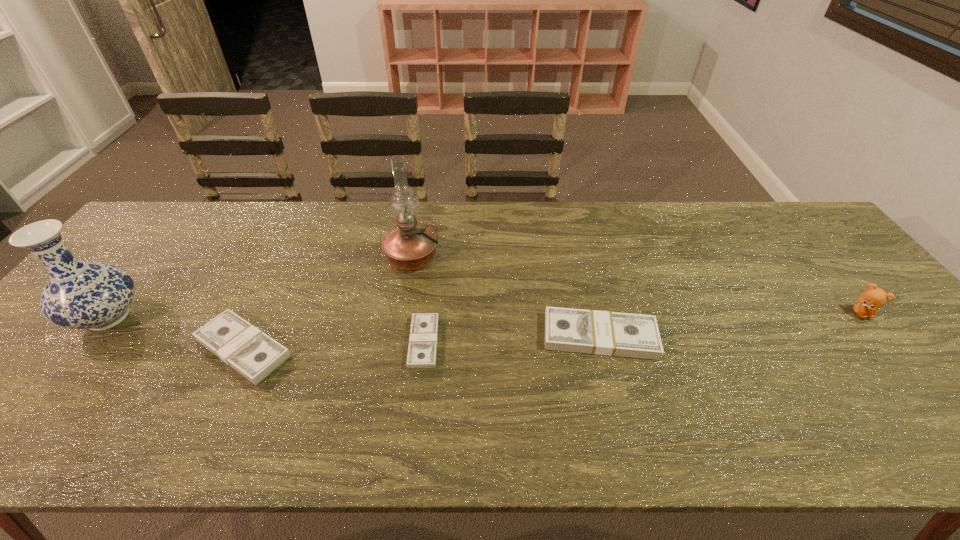
Locate an element on the screen. This screenshot has width=960, height=540. vacant area situated on the back of the second object from left to right is located at coordinates (268, 295).

The height and width of the screenshot is (540, 960). I want to click on vacant space located 0.390m on the right of the shortest dollar, so click(x=597, y=342).

Find the location of a particular element. The height and width of the screenshot is (540, 960). free space located 0.150m on the right of the rightmost dollar is located at coordinates (717, 336).

What are the coordinates of `vacant region located 0.100m on the front of the farthest object` in the screenshot? It's located at click(x=405, y=302).

Find the location of `vacant space positioned 0.300m on the back of the vase`. vacant space positioned 0.300m on the back of the vase is located at coordinates (182, 225).

What are the coordinates of `blank space located on the face of the fourth shortest object` in the screenshot? It's located at (888, 346).

Identify the location of object present at the far edge. The height and width of the screenshot is (540, 960). (408, 247).

In order to click on object that is positioned at the near edge in this screenshot , I will do `click(252, 353)`.

The width and height of the screenshot is (960, 540). Find the location of `object at the left edge`. object at the left edge is located at coordinates (79, 295).

At what (x,y) coordinates should I click in order to perform the action: click on object present at the right edge. Please return your answer as a coordinate pair (x, y). Looking at the image, I should click on (870, 300).